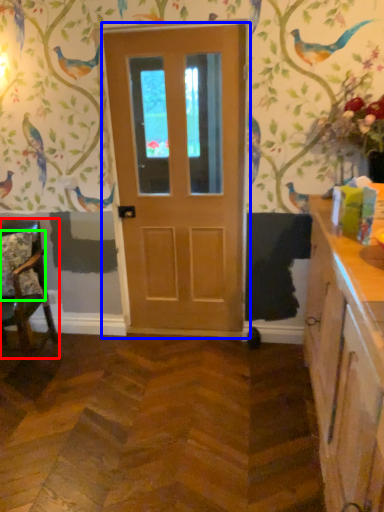
Question: Estimate the real-world distances between objects in this image. Which object is farther from chair (highlighted by a red box), door (highlighted by a blue box) or pillow (highlighted by a green box)?

Choices:
 (A) door
 (B) pillow

Answer: (A)